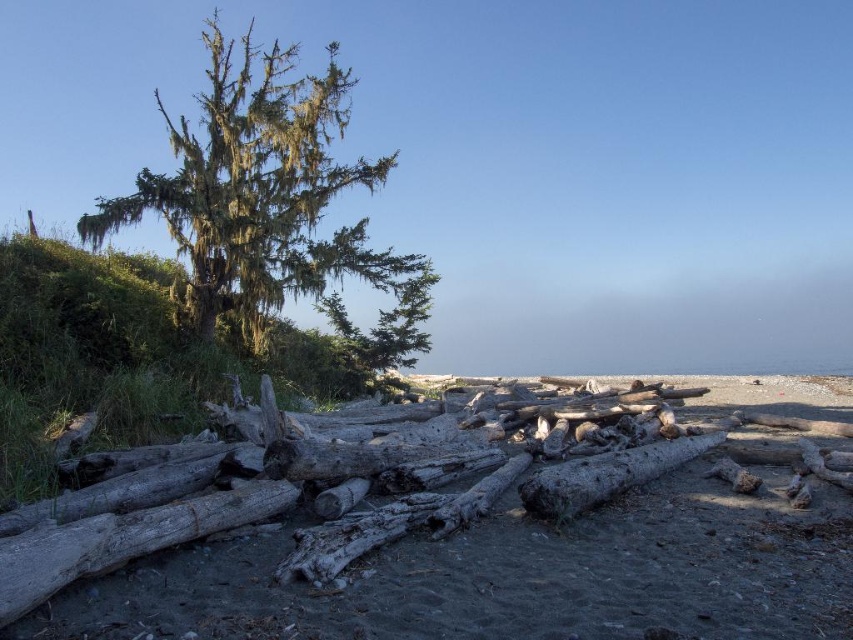
Question: Can you confirm if weathered wood logs at center is wider than green mossy tree at upper left?

Choices:
 (A) yes
 (B) no

Answer: (B)

Question: Is weathered wood logs at center positioned behind green mossy tree at upper left?

Choices:
 (A) yes
 (B) no

Answer: (B)

Question: Can you confirm if weathered wood logs at center is positioned below green mossy tree at upper left?

Choices:
 (A) no
 (B) yes

Answer: (B)

Question: Which point is closer to the camera taking this photo?

Choices:
 (A) (306, 532)
 (B) (265, 145)

Answer: (A)

Question: Among these points, which one is farthest from the camera?

Choices:
 (A) (161, 547)
 (B) (265, 300)

Answer: (B)

Question: Which point is farther to the camera?

Choices:
 (A) weathered wood logs at center
 (B) green mossy tree at upper left

Answer: (B)